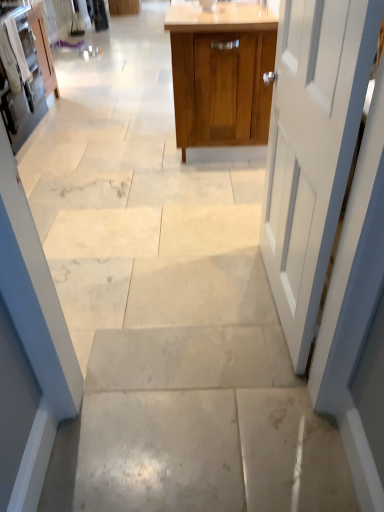
Question: From the image's perspective, is white painted wood door at right above or below matte white cabinet at upper left, the 1th cabinetry from the left?

Choices:
 (A) above
 (B) below

Answer: (B)

Question: Considering their positions, is white painted wood door at right located in front of or behind matte white cabinet at upper left, the 1th cabinetry from the left?

Choices:
 (A) behind
 (B) front

Answer: (B)

Question: Which is nearer to the matte white cabinet at left, which is counted as the second cabinetry, starting from the left?

Choices:
 (A) matte white cabinet at upper left, which is the third cabinetry in right-to-left order
 (B) wooden cabinet at center, the third cabinetry positioned from the left
 (C) white painted wood door at right

Answer: (A)

Question: Based on their relative distances, which object is nearer to the matte white cabinet at upper left, the 1th cabinetry from the left?

Choices:
 (A) white painted wood door at right
 (B) wooden cabinet at center, the third cabinetry positioned from the left
 (C) matte white cabinet at left, which is counted as the second cabinetry, starting from the left

Answer: (C)